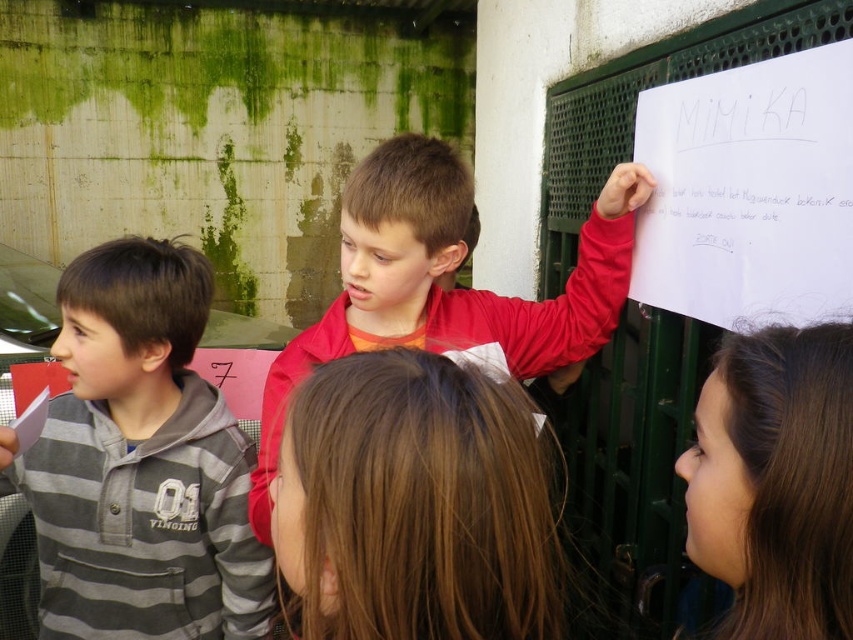
You are a photographer trying to capture a clear shot of the brown hair at center and the gray striped hoodie at left. Since you can only focus on one subject at a time, which one should you choose to ensure the other is still in the background?

You should focus on the gray striped hoodie at left because the brown hair at center is behind it, so the gray striped hoodie at left will be in focus while the brown hair at center remains in the background.

You are a photographer taking a picture of the group of children. You notice the gray striped hoodie at left and the brown hair at center. Which object should you focus on first if you want to capture both in the frame without moving the camera?

The gray striped hoodie at left is located below brown hair at center, so you should focus on the brown hair at center first to ensure both are in the frame without moving the camera.